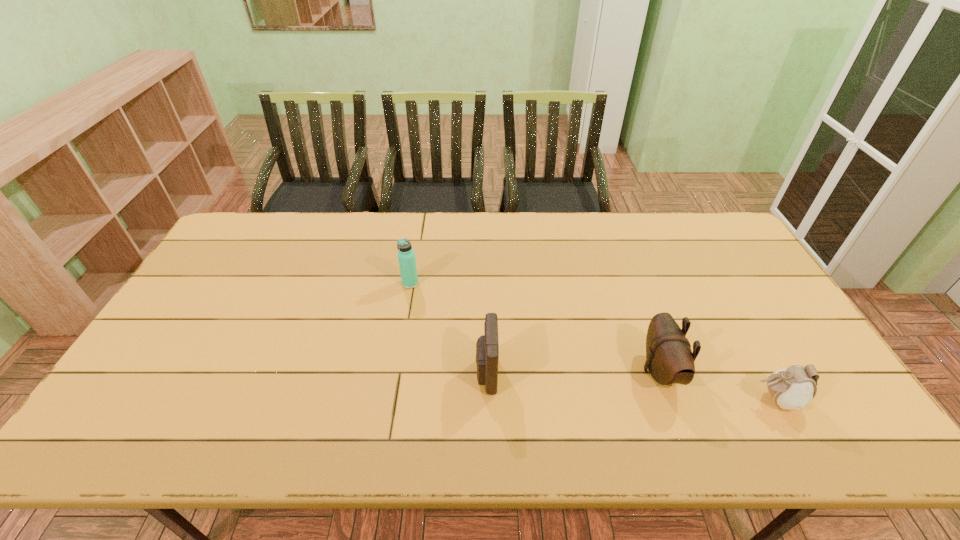
I want to click on the leftmost object, so click(406, 256).

At what (x,y) coordinates should I click in order to perform the action: click on the farthest object. Please return your answer as a coordinate pair (x, y). Looking at the image, I should click on (406, 256).

Locate an element on the screen. This screenshot has width=960, height=540. the leftmost pouch is located at coordinates (487, 347).

The width and height of the screenshot is (960, 540). In order to click on the second pouch from right to left in this screenshot , I will do `click(669, 358)`.

Where is `the shortest object`? This screenshot has width=960, height=540. the shortest object is located at coordinates (793, 388).

Identify the location of the shortest pouch. Image resolution: width=960 pixels, height=540 pixels. (793, 388).

Where is `vacant space located on the back of the farthest object`? Image resolution: width=960 pixels, height=540 pixels. vacant space located on the back of the farthest object is located at coordinates (418, 237).

Image resolution: width=960 pixels, height=540 pixels. In order to click on free location located 0.120m with an open flap on the second object from left to right in this screenshot , I will do `click(429, 374)`.

Identify the location of vacant space located 0.240m with an open flap on the second object from left to right. (382, 374).

In order to click on vacant area located with an open flap on the second object from left to right in this screenshot , I will do `click(371, 374)`.